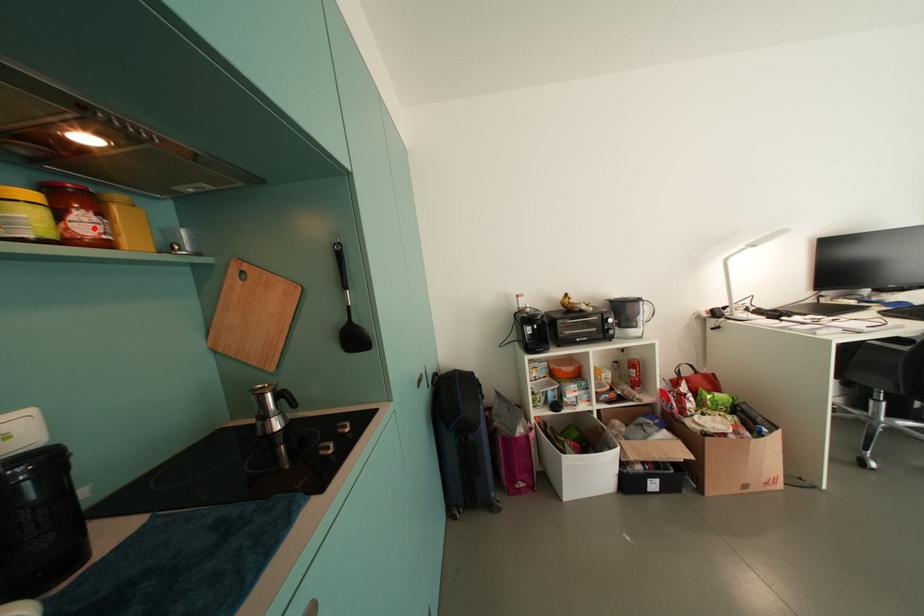
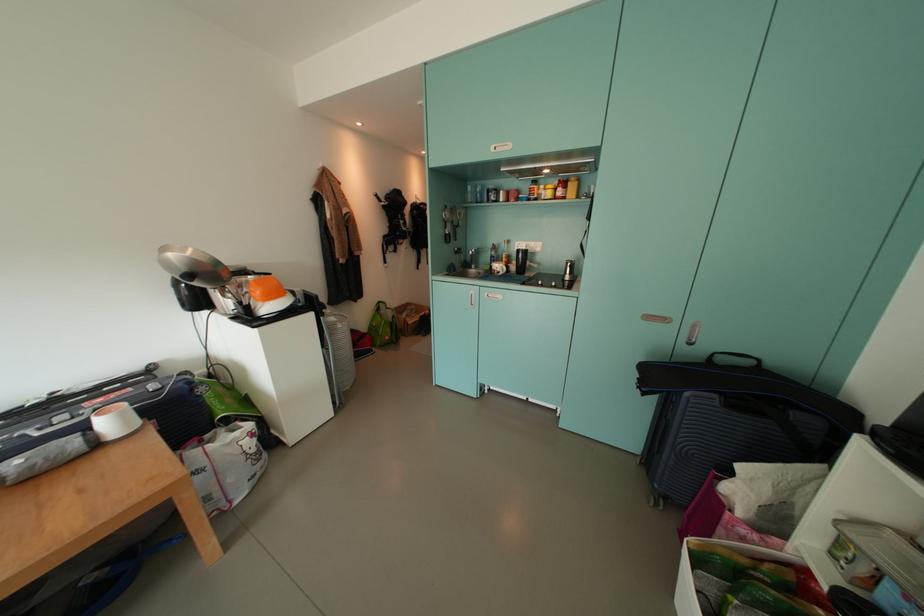
Question: A red point is marked in image1. In image2, is the corresponding 3D point closer to the camera or farther? Reply with the corresponding letter.

Choices:
 (A) The corresponding 3D point is closer.
 (B) The corresponding 3D point is farther.

Answer: (A)